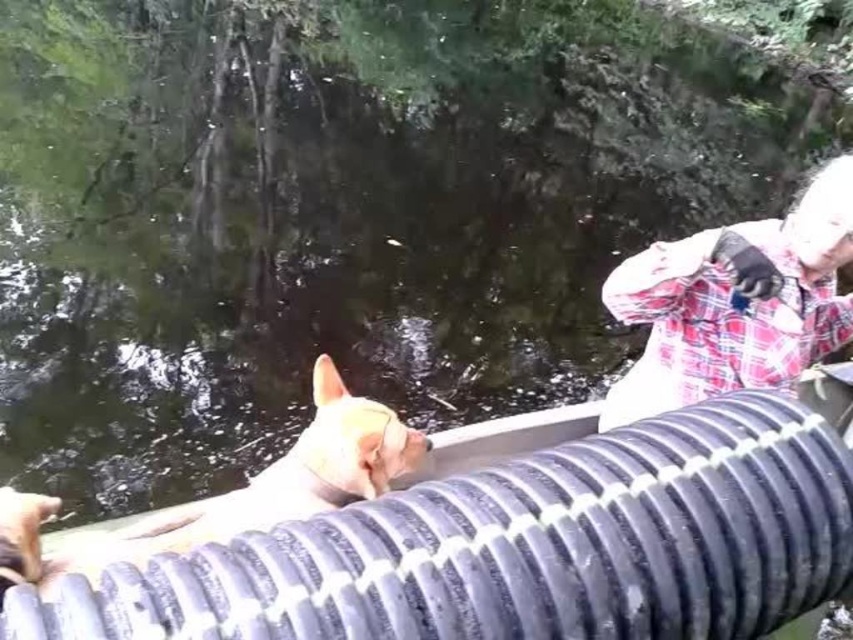
Question: Is the position of black rubber hose at center less distant than that of white plaid shirt at upper right?

Choices:
 (A) yes
 (B) no

Answer: (A)

Question: Which of the following is the farthest from the observer?

Choices:
 (A) (810, 470)
 (B) (641, 404)
 (C) (170, 513)

Answer: (B)

Question: Is white plaid shirt at upper right bigger than light brown fur cat at center?

Choices:
 (A) yes
 (B) no

Answer: (A)

Question: Among these points, which one is farthest from the camera?

Choices:
 (A) (767, 221)
 (B) (462, 628)

Answer: (A)

Question: Which point is closer to the camera?

Choices:
 (A) (663, 394)
 (B) (564, 540)
 (C) (323, 460)

Answer: (B)

Question: Can you confirm if black rubber hose at center is thinner than light brown fur cat at center?

Choices:
 (A) no
 (B) yes

Answer: (A)